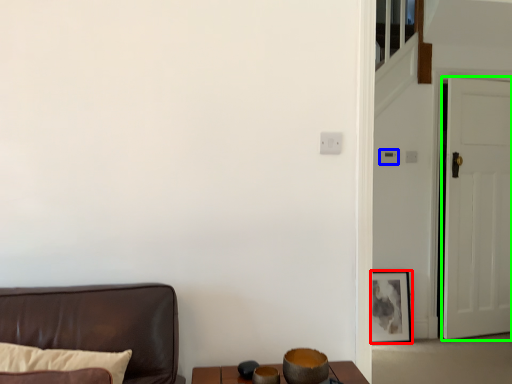
Question: Which object is positioned farthest from picture frame (highlighted by a red box)? Select from light switch (highlighted by a blue box) and door (highlighted by a green box).

Choices:
 (A) light switch
 (B) door

Answer: (A)